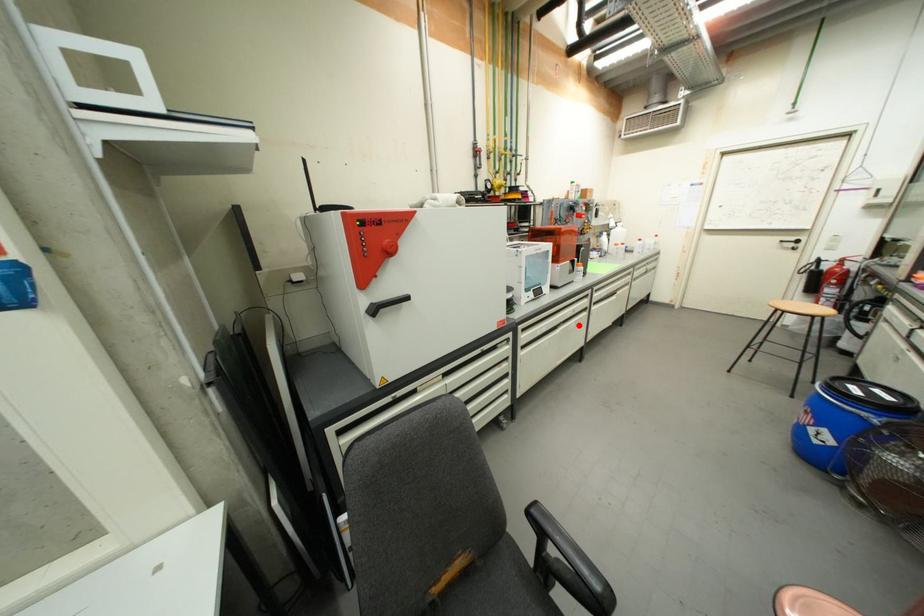
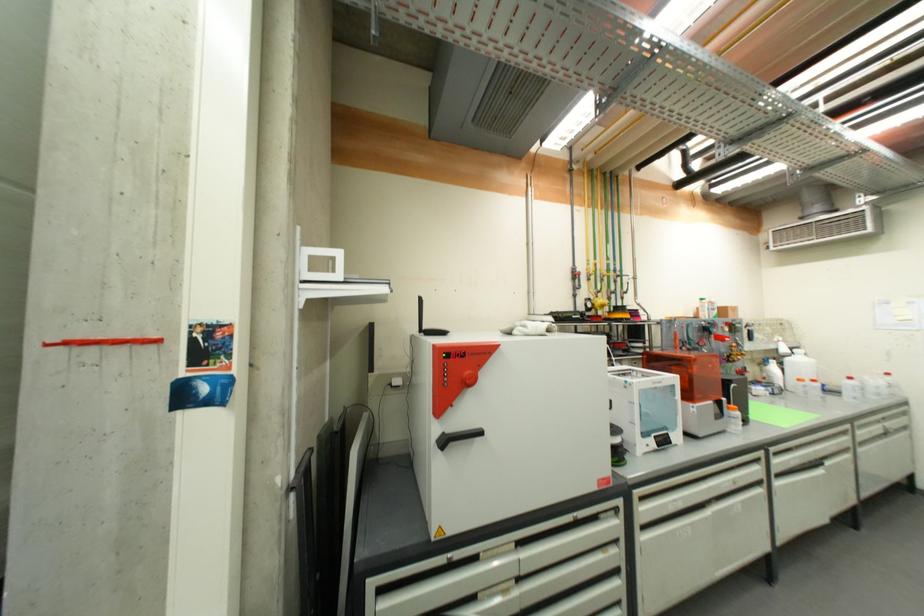
Question: A red point is marked in image1. In image2, is the corresponding 3D point closer to the camera or farther? Reply with the corresponding letter.

Choices:
 (A) The corresponding 3D point is closer.
 (B) The corresponding 3D point is farther.

Answer: (A)